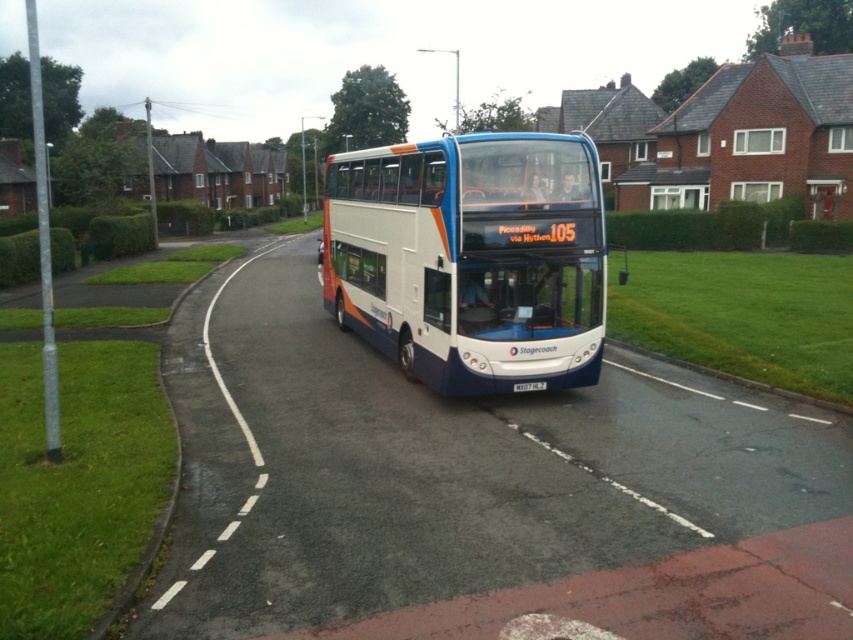
You are standing on the road near the Stagecoach bus route 105 and want to place two markers at the specified coordinates. Which of the two points, point (555, 358) or point (529, 384), is closer to you?

Result: Point (555, 358) is further to the viewer than point (529, 384). Therefore, point (529, 384) is closer to you.

You are a pedestrian standing on the sidewalk next to the road. You see the white glossy decker bus at center and the white plastic license plate at center. If you want to cross the road to the other side, can you safely step between them without getting too close to the bus?

The distance between the white glossy decker bus at center and the white plastic license plate at center is 10.75 feet. Since the license plate is part of the bus, stepping between them would actually mean stepping onto the bus itself, which is dangerous. Therefore, it is not safe to attempt crossing there.

You are standing at the point marked by the coordinates point (469, 257) in the image. What object are you directly at?

You are directly at the white glossy decker bus at center.